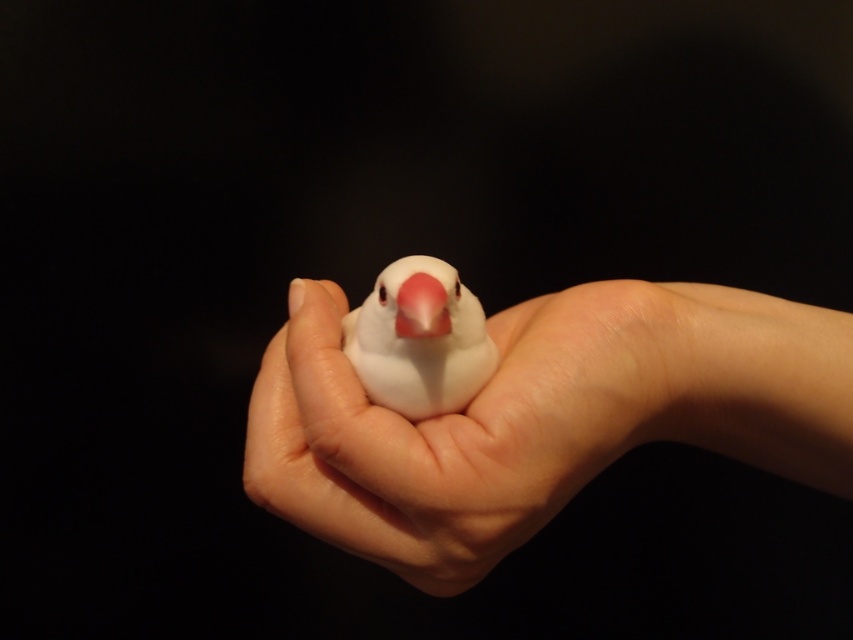
You are a veterinarian examining a bird in a patient. The bird is resting in the smooth skin hand at center. The pink matte beak at center is visible. Which object is taller?

The smooth skin hand at center is much taller than the pink matte beak at center.

You are a photographer trying to capture the bird in the palm of the hand. You notice two points marked on your screen at coordinates point (349,339) and point (408,333). Which point is closer to the camera?

Point (408,333) is closer to the camera because it is in front of point (349,339).